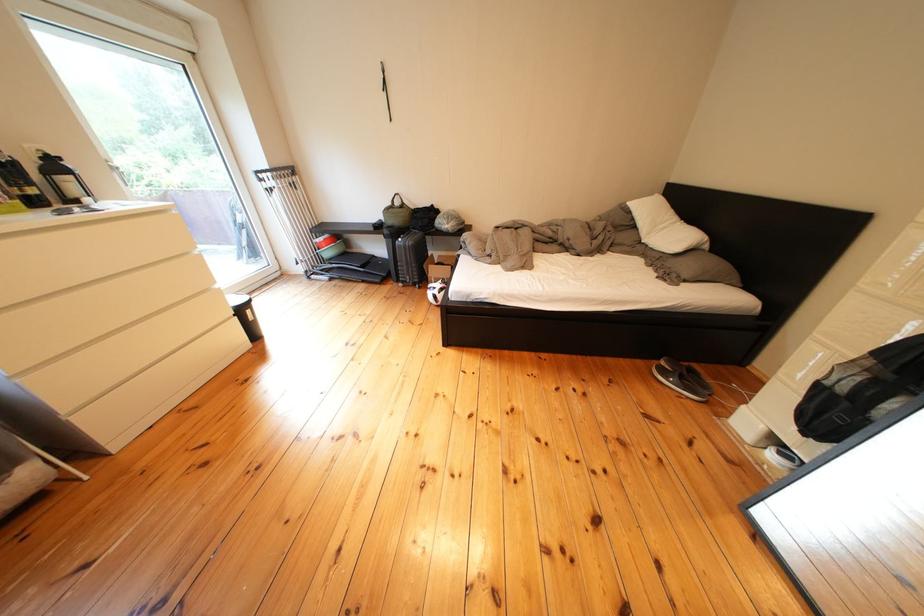
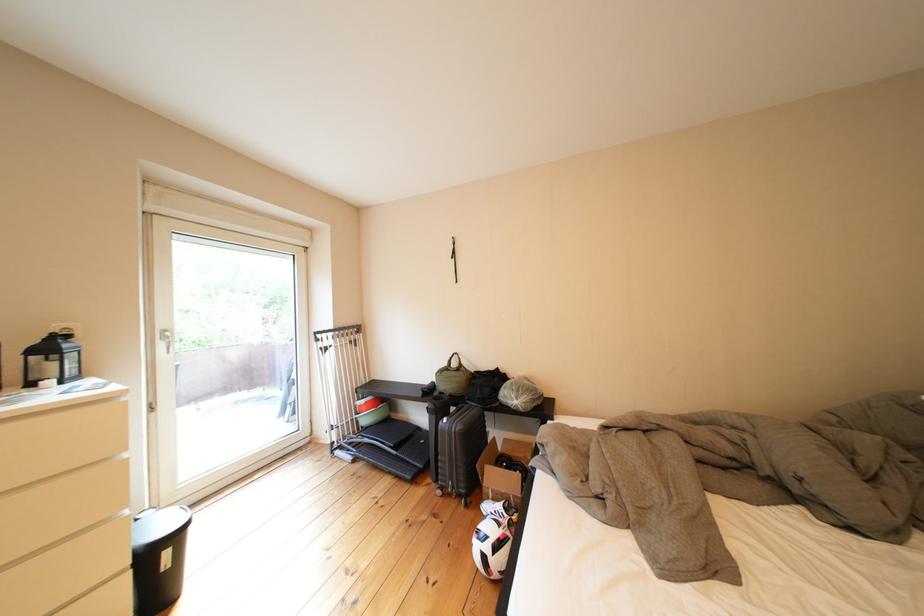
The point at (x=250, y=304) is marked in the first image. Where is the corresponding point in the second image?

(172, 533)